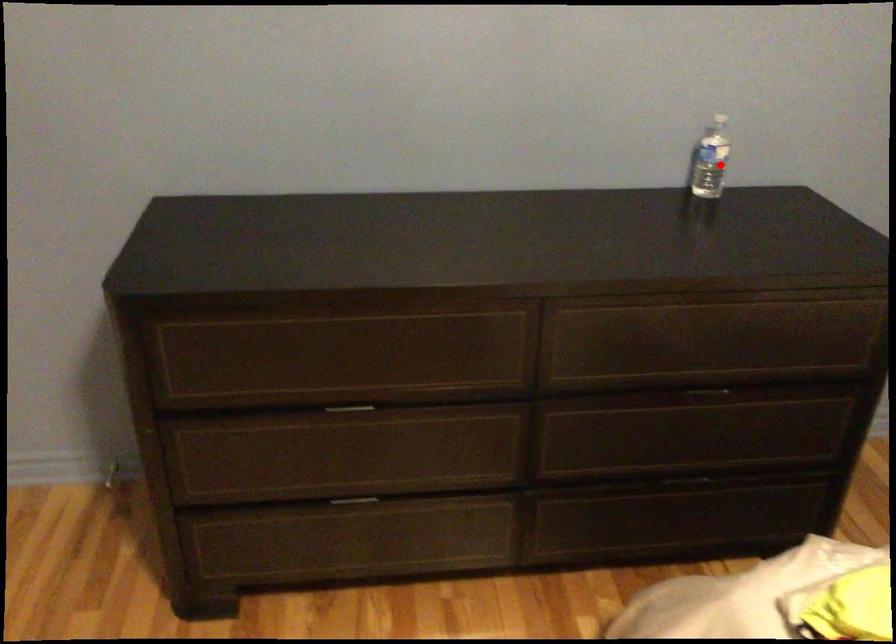
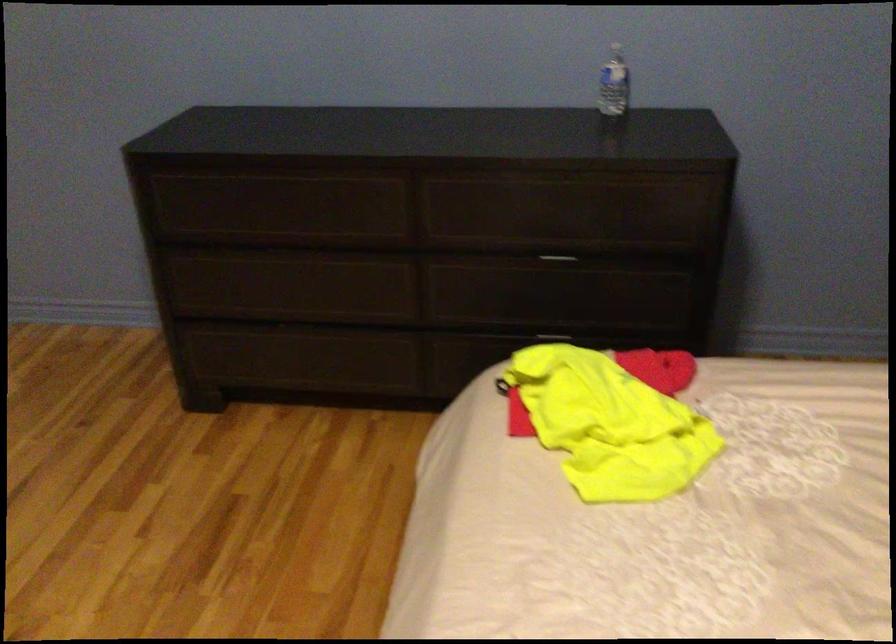
Where in the second image is the point corresponding to the highlighted location from the first image?

(614, 84)